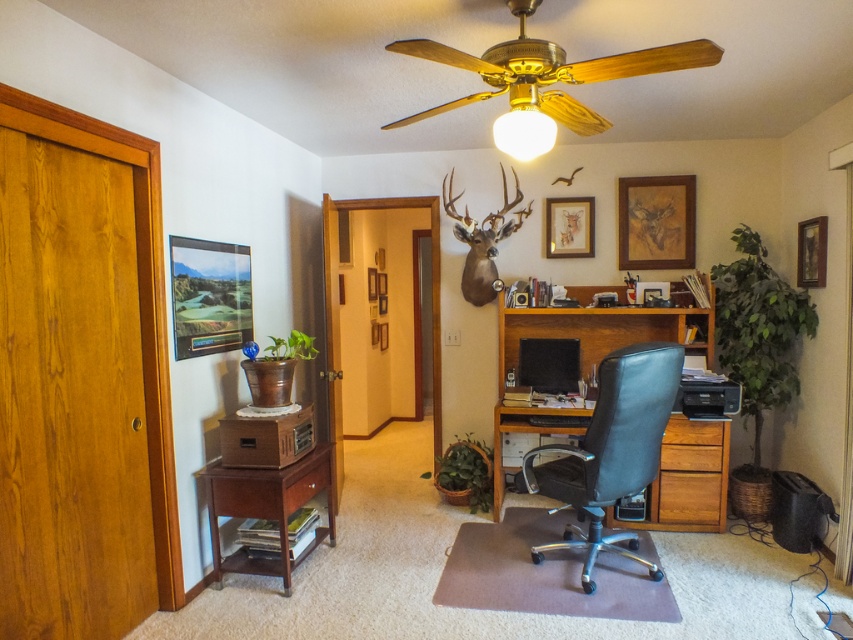
You are an interior designer planning to hang a new picture frame in this home office. The existing matte black picture frame at upper left is already placed at coordinates 0.464 on the x and 0.246 on the y axis. If you want to hang a new frame 10 cm to the right of the existing one, what would be the new x coordinate?

The new x coordinate would be 0.464 plus 0.01, resulting in 0.474. This adjustment ensures the new frame is positioned 10 cm to the right of the existing matte black picture frame at upper left.

You are organizing your home office and want to hang a new picture frame. You have a matte black picture frame at upper left and a wooden drawer at center. Which object is positioned higher up in the room?

The matte black picture frame at upper left is located above the wooden drawer at center, so it is positioned higher up in the room.

Based on the scene description, where is the wooden picture frame at upper right located in terms of its position relative to the door and the desk area?

The wooden picture frame at upper right is located at the upper right corner of the scene, positioned above the desk area and to the right side of the wooden door.